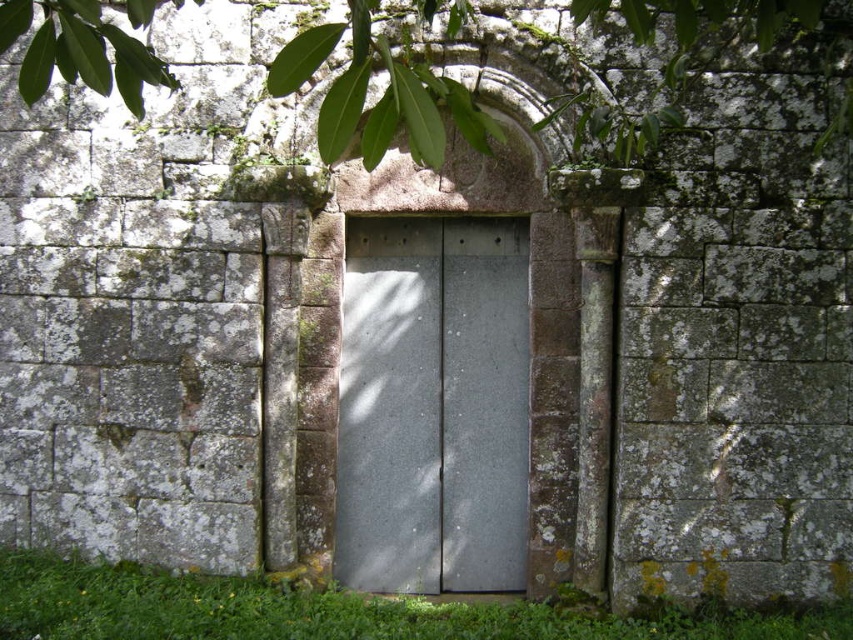
Is green leafy tree at upper center bigger than green grass at bottom?

Yes.

Is point (160, 81) positioned after point (221, 616)?

No, it is in front of (221, 616).

Is point (633, 38) positioned after point (430, 616)?

Yes, point (633, 38) is farther from viewer.

In order to click on green leafy tree at upper center in this screenshot , I will do `click(386, 84)`.

Who is positioned more to the right, slate gray metal door at center or green leafy tree at upper center?

Positioned to the right is green leafy tree at upper center.

Does slate gray metal door at center appear on the left side of green leafy tree at upper center?

Correct, you'll find slate gray metal door at center to the left of green leafy tree at upper center.

I want to click on slate gray metal door at center, so click(x=433, y=404).

Is point (378, 301) positioned after point (611, 627)?

That is True.

Does point (519, 221) come closer to viewer compared to point (466, 620)?

That is False.

This screenshot has height=640, width=853. Find the location of `slate gray metal door at center`. slate gray metal door at center is located at coordinates (433, 404).